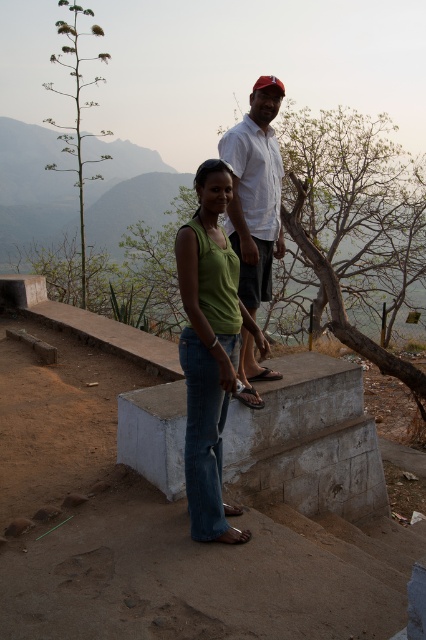
Is green matte tank top at center to the left of white cotton shirt at upper center from the viewer's perspective?

Correct, you'll find green matte tank top at center to the left of white cotton shirt at upper center.

Does green matte tank top at center have a greater width compared to white cotton shirt at upper center?

Correct, the width of green matte tank top at center exceeds that of white cotton shirt at upper center.

What do you see at coordinates (210, 349) in the screenshot? This screenshot has height=640, width=426. I see `green matte tank top at center` at bounding box center [210, 349].

The image size is (426, 640). What are the coordinates of `green matte tank top at center` in the screenshot? It's located at (210, 349).